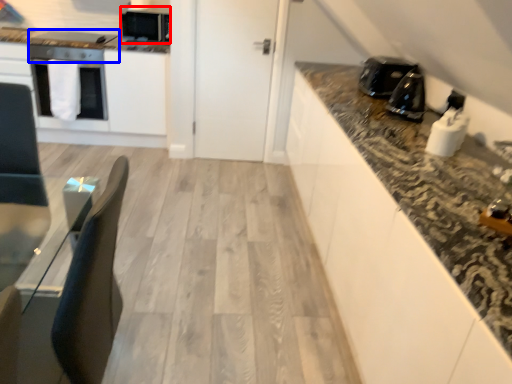
Question: Which object appears closest to the camera in this image, appliance (highlighted by a red box) or appliance (highlighted by a blue box)?

Choices:
 (A) appliance
 (B) appliance

Answer: (B)